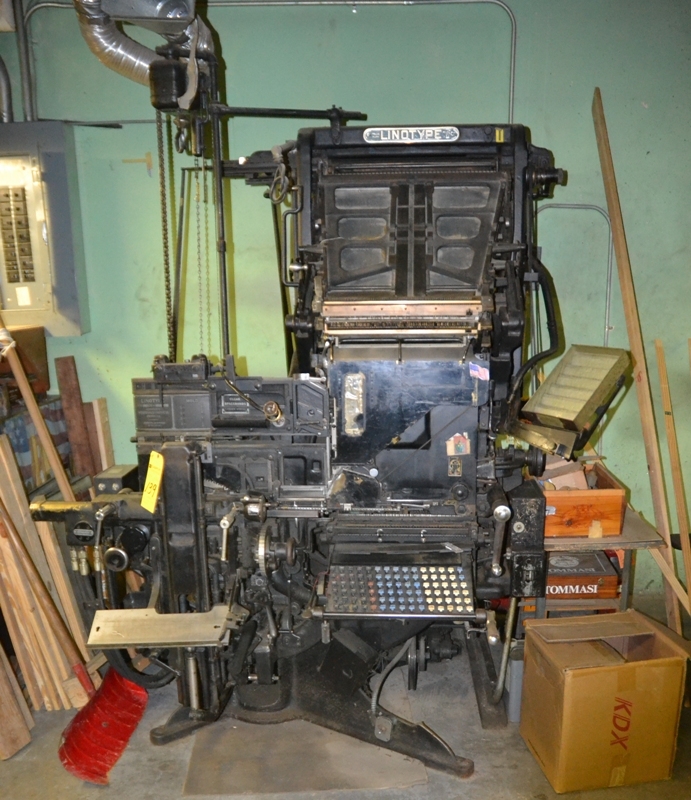
At what (x,y) coordinates should I click in order to perform the action: click on breaker box. Please return your answer as a coordinate pair (x, y). The image size is (691, 800). Looking at the image, I should click on (30, 225).